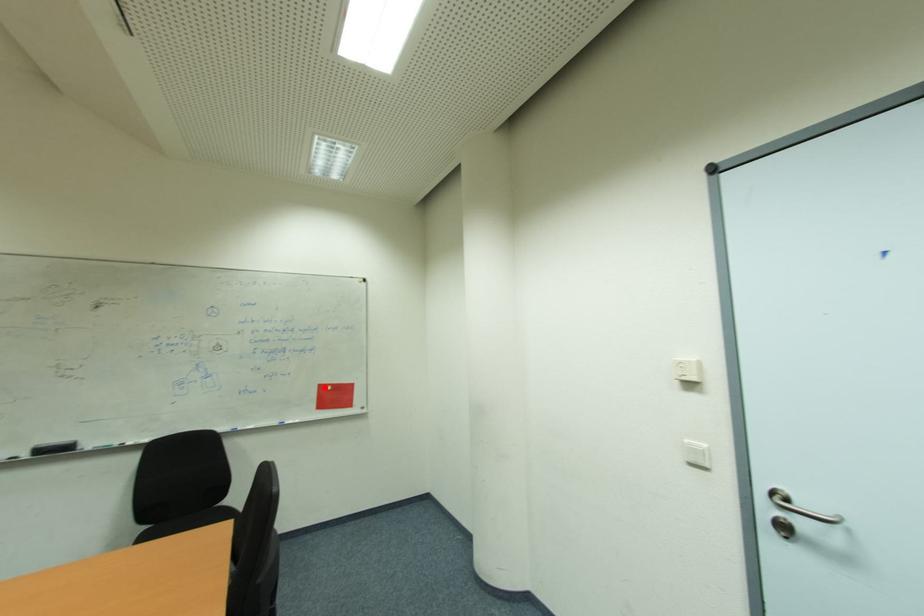
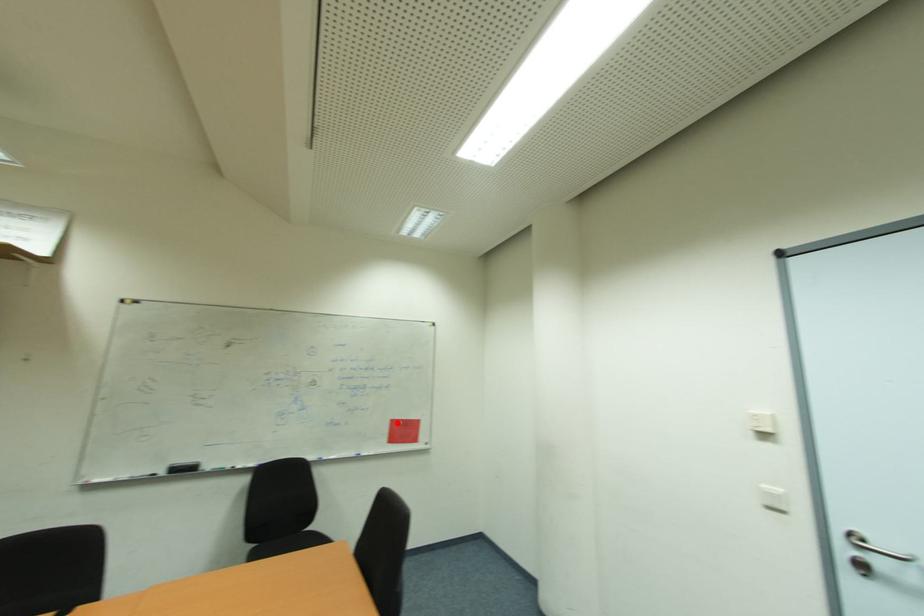
I am providing you with two images of the same scene from different viewpoints. A red point is marked on the first image and another point is marked on the second image. Is the marked point in image1 the same physical position as the marked point in image2?

Yes